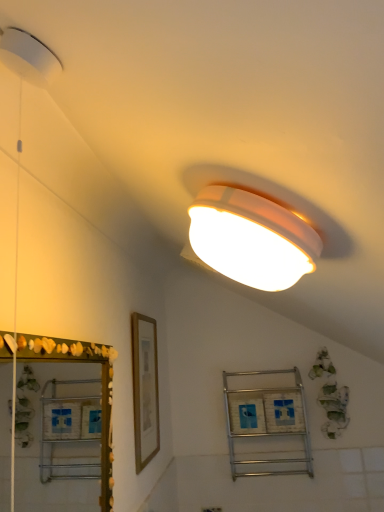
Question: From a real-world perspective, does gold wooden picture frame at center-left stand above green shell mirror at left?

Choices:
 (A) yes
 (B) no

Answer: (A)

Question: Considering the relative sizes of gold wooden picture frame at center-left and green shell mirror at left in the image provided, is gold wooden picture frame at center-left taller than green shell mirror at left?

Choices:
 (A) yes
 (B) no

Answer: (A)

Question: From a real-world perspective, does gold wooden picture frame at center-left sit lower than green shell mirror at left?

Choices:
 (A) yes
 (B) no

Answer: (B)

Question: Does gold wooden picture frame at center-left touch green shell mirror at left?

Choices:
 (A) no
 (B) yes

Answer: (A)

Question: Can you confirm if gold wooden picture frame at center-left is wider than green shell mirror at left?

Choices:
 (A) no
 (B) yes

Answer: (A)

Question: Is gold wooden picture frame at center-left shorter than green shell mirror at left?

Choices:
 (A) yes
 (B) no

Answer: (B)

Question: Is metallic silver shelf at center turned away from white plastic electric outlet at lower center?

Choices:
 (A) no
 (B) yes

Answer: (A)

Question: Considering the relative sizes of metallic silver shelf at center and white plastic electric outlet at lower center in the image provided, is metallic silver shelf at center taller than white plastic electric outlet at lower center?

Choices:
 (A) no
 (B) yes

Answer: (B)

Question: Does metallic silver shelf at center lie behind white plastic electric outlet at lower center?

Choices:
 (A) no
 (B) yes

Answer: (A)

Question: From the image's perspective, would you say metallic silver shelf at center is positioned over white plastic electric outlet at lower center?

Choices:
 (A) no
 (B) yes

Answer: (B)

Question: From the image's perspective, would you say metallic silver shelf at center is shown under white plastic electric outlet at lower center?

Choices:
 (A) no
 (B) yes

Answer: (A)

Question: From a real-world perspective, is metallic silver shelf at center below white plastic electric outlet at lower center?

Choices:
 (A) yes
 (B) no

Answer: (B)

Question: From a real-world perspective, is green shell mirror at left on white plastic electric outlet at lower center?

Choices:
 (A) no
 (B) yes

Answer: (B)